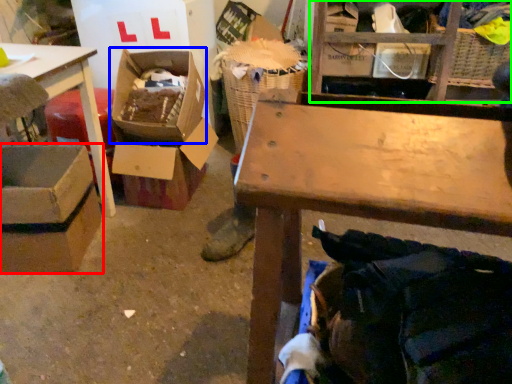
Question: Which is farther away from box (highlighted by a red box)? storage box (highlighted by a blue box) or shelf (highlighted by a green box)?

Choices:
 (A) storage box
 (B) shelf

Answer: (B)